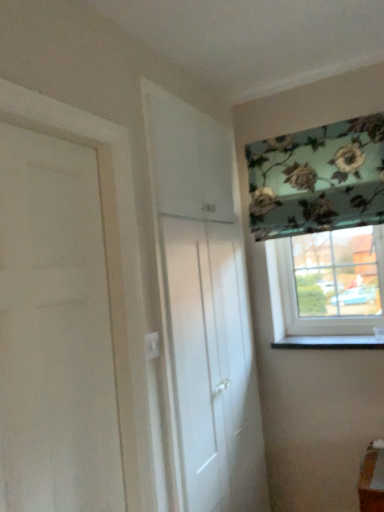
Question: Considering the relative sizes of clear glass window at right, placed as the 1th window when sorted from bottom to top, and white glossy cabinet at center, positioned as the 1th door in back-to-front order, in the image provided, is clear glass window at right, placed as the 1th window when sorted from bottom to top, wider than white glossy cabinet at center, positioned as the 1th door in back-to-front order,?

Choices:
 (A) yes
 (B) no

Answer: (A)

Question: Is clear glass window at right, the second window in the top-to-bottom sequence, at the right side of white glossy cabinet at center, marked as the 2th door in a left-to-right arrangement?

Choices:
 (A) yes
 (B) no

Answer: (A)

Question: Is clear glass window at right, placed as the 1th window when sorted from bottom to top, closer to camera compared to white glossy cabinet at center, which is the second door from front to back?

Choices:
 (A) no
 (B) yes

Answer: (A)

Question: From the image's perspective, would you say clear glass window at right, the second window in the top-to-bottom sequence, is shown under white glossy cabinet at center, marked as the 2th door in a left-to-right arrangement?

Choices:
 (A) yes
 (B) no

Answer: (B)

Question: From a real-world perspective, is clear glass window at right, the second window in the top-to-bottom sequence, beneath white glossy cabinet at center, which ranks as the 1th door in right-to-left order?

Choices:
 (A) no
 (B) yes

Answer: (A)

Question: Is clear glass window at right, placed as the 1th window when sorted from bottom to top, thinner than white glossy cabinet at center, which ranks as the 1th door in right-to-left order?

Choices:
 (A) no
 (B) yes

Answer: (A)

Question: Is floral fabric at upper right, positioned as the first window in top-to-bottom order, to the right of white matte door at left, the first door when ordered from left to right, from the viewer's perspective?

Choices:
 (A) no
 (B) yes

Answer: (B)

Question: Can you confirm if floral fabric at upper right, placed as the second window when sorted from bottom to top, is wider than white matte door at left, which is counted as the second door, starting from the back?

Choices:
 (A) no
 (B) yes

Answer: (B)

Question: From the image's perspective, is floral fabric at upper right, positioned as the first window in top-to-bottom order, under white matte door at left, acting as the 2th door starting from the right?

Choices:
 (A) no
 (B) yes

Answer: (A)

Question: Are floral fabric at upper right, placed as the second window when sorted from bottom to top, and white matte door at left, which is counted as the second door, starting from the back, far apart?

Choices:
 (A) no
 (B) yes

Answer: (B)

Question: Could you tell me if floral fabric at upper right, placed as the second window when sorted from bottom to top, is turned towards white matte door at left, which is counted as the second door, starting from the back?

Choices:
 (A) yes
 (B) no

Answer: (A)

Question: Is white matte door at left, which is counted as the second door, starting from the back, a part of floral fabric at upper right, positioned as the first window in top-to-bottom order?

Choices:
 (A) no
 (B) yes

Answer: (A)

Question: Considering the relative positions of clear glass window at right, the second window in the top-to-bottom sequence, and white matte door at left, which is counted as the second door, starting from the back, in the image provided, is clear glass window at right, the second window in the top-to-bottom sequence, to the left of white matte door at left, which is counted as the second door, starting from the back, from the viewer's perspective?

Choices:
 (A) yes
 (B) no

Answer: (B)